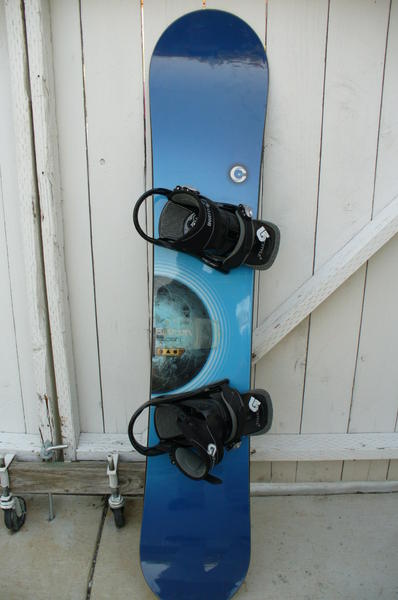
This screenshot has height=600, width=398. I want to click on wooden board, so click(80, 481).